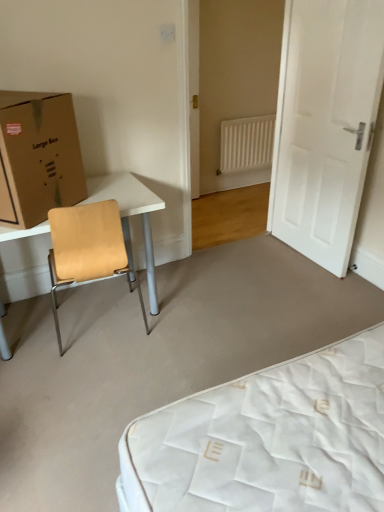
Question: Considering the positions of light brown wood table at left and white matte door at right in the image, is light brown wood table at left wider or thinner than white matte door at right?

Choices:
 (A) thin
 (B) wide

Answer: (B)

Question: Is light brown wood table at left inside the boundaries of white matte door at right, or outside?

Choices:
 (A) outside
 (B) inside

Answer: (A)

Question: Considering the real-world distances, which object is farthest from the light brown wood table at left?

Choices:
 (A) brown cardboard box at left
 (B) white plastic radiator at center
 (C) white matte door at right

Answer: (B)

Question: Considering the real-world distances, which object is closest to the white plastic radiator at center?

Choices:
 (A) brown cardboard box at left
 (B) white matte door at right
 (C) light brown wood table at left

Answer: (B)